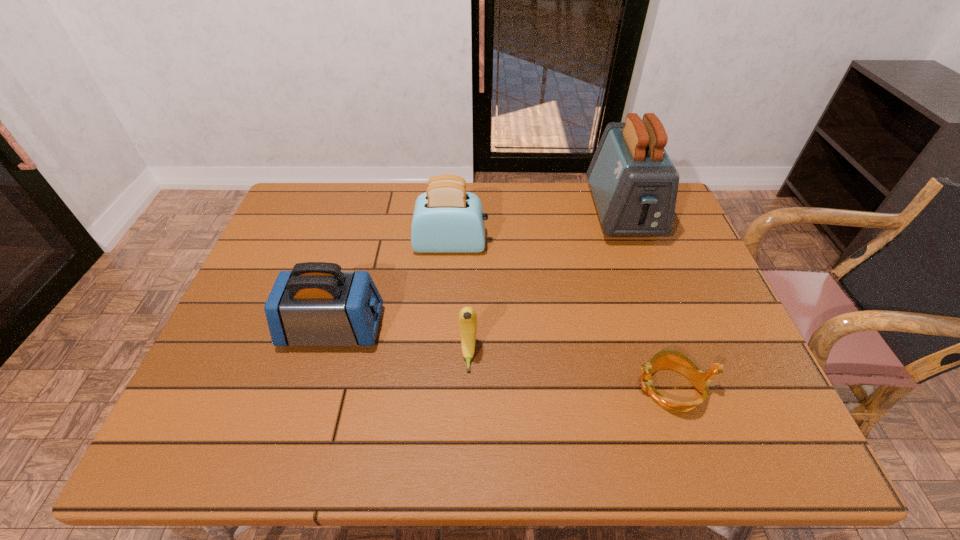
Where is `blank area located 0.050m from the stem of the fourth tallest object`? The image size is (960, 540). blank area located 0.050m from the stem of the fourth tallest object is located at coordinates (468, 393).

Identify the location of vacant area situated at the front emblem of the shortest object. point(504,388).

The image size is (960, 540). What are the coordinates of `free space located 0.230m at the front emblem of the shortest object` in the screenshot? It's located at (527, 388).

What are the coordinates of `vacant area located 0.400m at the front emblem of the shortest object` in the screenshot? It's located at (449, 388).

Find the location of `object that is positioned at the far edge`. object that is positioned at the far edge is located at coordinates (634, 184).

Where is `object that is at the near edge`? The height and width of the screenshot is (540, 960). object that is at the near edge is located at coordinates (672, 359).

You are a GUI agent. You are given a task and a screenshot of the screen. Output one action in this format:
    pyautogui.click(x=<x>, y=<y>)
    Task: Click on the object present at the left edge
    The image size is (960, 540).
    Given the screenshot: What is the action you would take?
    pyautogui.click(x=316, y=304)

Where is `toaster at the right edge`? toaster at the right edge is located at coordinates (634, 184).

Locate an element on the screen. This screenshot has height=540, width=960. tiara present at the right edge is located at coordinates (672, 359).

I want to click on object that is at the far right corner, so click(634, 184).